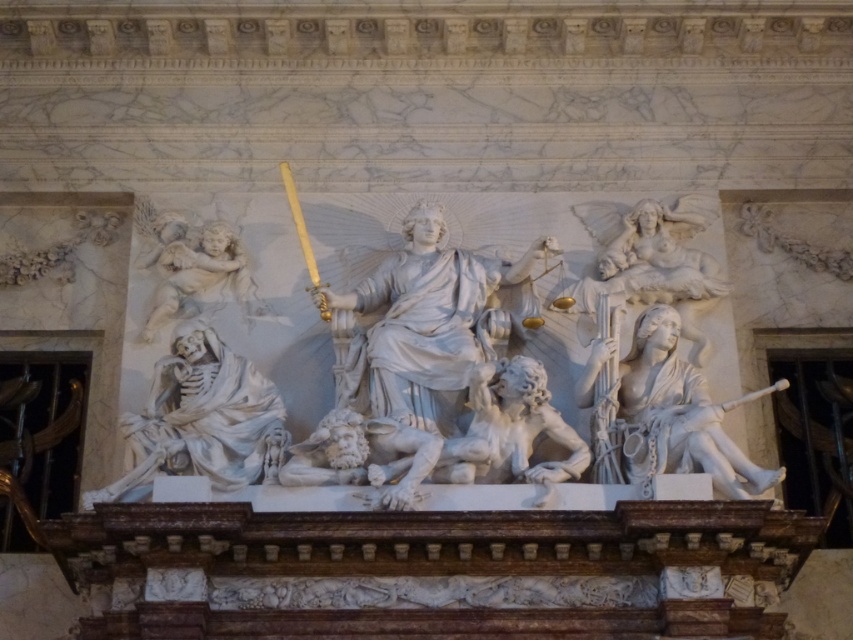
Question: Is white marble angel at upper right bigger than white marble cherub at upper left?

Choices:
 (A) no
 (B) yes

Answer: (B)

Question: Is white marble woman at right positioned at the back of white marble cherub at upper left?

Choices:
 (A) yes
 (B) no

Answer: (B)

Question: Among these points, which one is farthest from the camera?

Choices:
 (A) (728, 497)
 (B) (189, 291)
 (C) (612, 252)
 (D) (192, 440)

Answer: (C)

Question: Which object is closer to the camera taking this photo?

Choices:
 (A) white marble skeleton at lower left
 (B) white marble woman at right
 (C) white marble cherub at upper left
 (D) white marble angel at upper right

Answer: (A)

Question: Does white marble woman at right appear over white marble angel at upper right?

Choices:
 (A) no
 (B) yes

Answer: (A)

Question: Which object is positioned closest to the white marble cherub at upper left?

Choices:
 (A) white marble skeleton at lower left
 (B) white marble angel at upper right

Answer: (A)